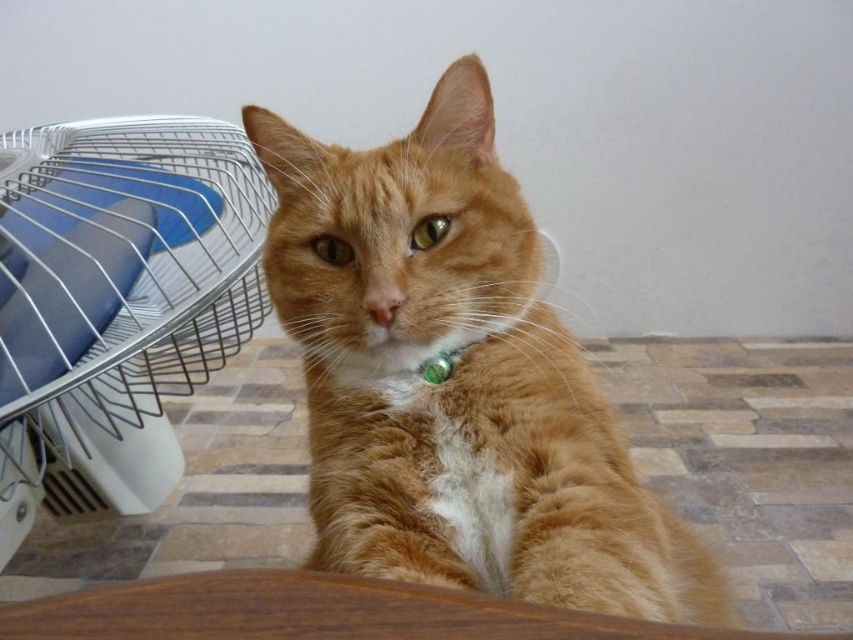
Question: Does orange fur cat at center have a greater width compared to white plastic fan at left?

Choices:
 (A) no
 (B) yes

Answer: (B)

Question: Which point is farther from the camera taking this photo?

Choices:
 (A) (38, 492)
 (B) (625, 508)

Answer: (A)

Question: Does orange fur cat at center appear under white plastic fan at left?

Choices:
 (A) no
 (B) yes

Answer: (B)

Question: Which point is closer to the camera?

Choices:
 (A) (469, 268)
 (B) (44, 273)

Answer: (A)

Question: Is orange fur cat at center further to camera compared to white plastic fan at left?

Choices:
 (A) yes
 (B) no

Answer: (B)